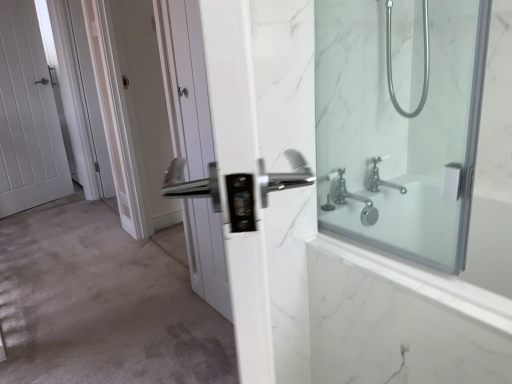
Identify the location of white wooden door at left, the first door viewed from the left. (28, 116).

This screenshot has width=512, height=384. What do you see at coordinates (140, 101) in the screenshot? I see `satin nickel handle at center, the first screen door when ordered from front to back` at bounding box center [140, 101].

I want to click on silver metallic shower arm at upper right, so click(x=391, y=61).

This screenshot has width=512, height=384. What do you see at coordinates (380, 179) in the screenshot?
I see `chrome metallic faucet at upper right` at bounding box center [380, 179].

What do you see at coordinates (187, 85) in the screenshot?
I see `white glossy door handle at center, arranged as the second door when viewed from the left` at bounding box center [187, 85].

You are a GUI agent. You are given a task and a screenshot of the screen. Output one action in this format:
    pyautogui.click(x=<x>, y=<y>)
    Task: Click on the white glossy door at upper left, the 1th screen door positioned from the back
    The image size is (512, 384).
    Given the screenshot: What is the action you would take?
    pyautogui.click(x=91, y=98)

Which object is positioned more to the left, white glossy door handle at center, the second door when ordered from back to front, or white glossy door at upper left, the first screen door when ordered from left to right?

white glossy door at upper left, the first screen door when ordered from left to right, is more to the left.

Would you say white glossy door handle at center, arranged as the second door when viewed from the left, contains white glossy door at upper left, which is the second screen door from front to back?

Definitely not — white glossy door at upper left, which is the second screen door from front to back, is not inside white glossy door handle at center, arranged as the second door when viewed from the left.

In the scene shown: From the image's perspective, who appears lower, white glossy door handle at center, the second door when ordered from back to front, or white glossy door at upper left, the first screen door when ordered from left to right?

white glossy door handle at center, the second door when ordered from back to front, from the image's perspective.

Is white glossy door handle at center, the 1th door when ordered from front to back, facing towards white glossy door at upper left, which is the second screen door from front to back?

No, white glossy door handle at center, the 1th door when ordered from front to back, is not aimed at white glossy door at upper left, which is the second screen door from front to back.

In the scene shown: Is satin nickel handle at center, acting as the 1th screen door starting from the right, at the left side of white wooden door at left, placed as the first door when sorted from back to front?

No.

Considering the sizes of satin nickel handle at center, acting as the 1th screen door starting from the right, and white wooden door at left, which appears as the second door when viewed from the front, in the image, is satin nickel handle at center, acting as the 1th screen door starting from the right, taller or shorter than white wooden door at left, which appears as the second door when viewed from the front,?

Clearly, satin nickel handle at center, acting as the 1th screen door starting from the right, is shorter compared to white wooden door at left, which appears as the second door when viewed from the front.

From the image's perspective, is satin nickel handle at center, acting as the 1th screen door starting from the right, below white wooden door at left, the 2th door in the right-to-left sequence?

Correct, satin nickel handle at center, acting as the 1th screen door starting from the right, appears lower than white wooden door at left, the 2th door in the right-to-left sequence, in the image.

Where is `door above the white glossy door handle at center, the 1th door from the right (from the image's perspective)`? Image resolution: width=512 pixels, height=384 pixels. door above the white glossy door handle at center, the 1th door from the right (from the image's perspective) is located at coordinates (28, 116).

Is white wooden door at left, placed as the first door when sorted from back to front, oriented away from white glossy door handle at center, the 1th door from the right?

white wooden door at left, placed as the first door when sorted from back to front, does not have its back to white glossy door handle at center, the 1th door from the right.

Consider the image. Who is smaller, white wooden door at left, the 2th door in the right-to-left sequence, or white glossy door handle at center, arranged as the second door when viewed from the left?

white glossy door handle at center, arranged as the second door when viewed from the left, is smaller.

Is white wooden door at left, the first door viewed from the left, completely or partially outside of white glossy door handle at center, the 1th door from the right?

Yes.

From the image's perspective, is white glossy door at upper left, which is the 2th screen door in right-to-left order, over chrome metallic faucet at upper right?

Yes, from the image's perspective, white glossy door at upper left, which is the 2th screen door in right-to-left order, is on top of chrome metallic faucet at upper right.

Is white glossy door at upper left, the 1th screen door positioned from the back, aimed at chrome metallic faucet at upper right?

No, white glossy door at upper left, the 1th screen door positioned from the back, is not aimed at chrome metallic faucet at upper right.

Is white glossy door at upper left, the first screen door when ordered from left to right, not near chrome metallic faucet at upper right?

Absolutely, white glossy door at upper left, the first screen door when ordered from left to right, is distant from chrome metallic faucet at upper right.

Which object is wider, white glossy door at upper left, the first screen door when ordered from left to right, or chrome metallic faucet at upper right?

chrome metallic faucet at upper right is wider.

How much distance is there between silver metallic shower arm at upper right and white glossy door at upper left, the first screen door when ordered from left to right?

silver metallic shower arm at upper right is 6.81 feet away from white glossy door at upper left, the first screen door when ordered from left to right.

The width and height of the screenshot is (512, 384). Identify the location of shower in front of the white glossy door at upper left, the first screen door when ordered from left to right. (391, 61).

In the scene shown: Which object is wider, silver metallic shower arm at upper right or white glossy door at upper left, the 1th screen door positioned from the back?

Wider between the two is silver metallic shower arm at upper right.

Choose the correct answer: Is silver metallic shower arm at upper right inside white glossy door at upper left, which is the second screen door from front to back, or outside it?

silver metallic shower arm at upper right is located beyond the bounds of white glossy door at upper left, which is the second screen door from front to back.

Relative to white glossy door handle at center, the 1th door from the right, is chrome metallic faucet at upper right in front or behind?

Clearly, chrome metallic faucet at upper right is behind white glossy door handle at center, the 1th door from the right.

Is chrome metallic faucet at upper right positioned with its back to white glossy door handle at center, the second door when ordered from back to front?

chrome metallic faucet at upper right does not have its back to white glossy door handle at center, the second door when ordered from back to front.

How much distance is there between chrome metallic faucet at upper right and white glossy door handle at center, the 1th door when ordered from front to back?

A distance of 30.35 inches exists between chrome metallic faucet at upper right and white glossy door handle at center, the 1th door when ordered from front to back.

Looking at this image, considering the sizes of objects chrome metallic faucet at upper right and white glossy door handle at center, arranged as the second door when viewed from the left, in the image provided, who is taller, chrome metallic faucet at upper right or white glossy door handle at center, arranged as the second door when viewed from the left,?

white glossy door handle at center, arranged as the second door when viewed from the left.

How much distance is there between clear glass shower at right and white glossy door at upper left, the first screen door when ordered from left to right?

A distance of 6.35 feet exists between clear glass shower at right and white glossy door at upper left, the first screen door when ordered from left to right.

From a real-world perspective, is clear glass shower at right positioned above or below white glossy door at upper left, the 1th screen door positioned from the back?

From a real-world perspective, clear glass shower at right is physically above white glossy door at upper left, the 1th screen door positioned from the back.

Which object is closer to the camera taking this photo, clear glass shower at right or white glossy door at upper left, the first screen door when ordered from left to right?

clear glass shower at right is in front.

Is clear glass shower at right positioned beyond the bounds of white glossy door at upper left, the 1th screen door positioned from the back?

Yes, clear glass shower at right is not within white glossy door at upper left, the 1th screen door positioned from the back.

You are a GUI agent. You are given a task and a screenshot of the screen. Output one action in this format:
    pyautogui.click(x=<x>, y=<y>)
    Task: Click on the door directly beneath the white glossy door at upper left, which is the second screen door from front to back (from a real-world perspective)
    This screenshot has width=512, height=384.
    Given the screenshot: What is the action you would take?
    pyautogui.click(x=187, y=85)

The height and width of the screenshot is (384, 512). Find the location of `door above the satin nickel handle at center, acting as the 2th screen door starting from the back (from a real-world perspective)`. door above the satin nickel handle at center, acting as the 2th screen door starting from the back (from a real-world perspective) is located at coordinates (28, 116).

From the image, which object appears to be farther from white glossy door at upper left, the 1th screen door positioned from the back, silver metallic shower arm at upper right or white matte door at center?

Among the two, silver metallic shower arm at upper right is located further to white glossy door at upper left, the 1th screen door positioned from the back.

From the image, which object appears to be farther from white glossy door at upper left, the first screen door when ordered from left to right, white glossy door handle at center, arranged as the second door when viewed from the left, or satin nickel handle at center, acting as the 1th screen door starting from the right?

The object further to white glossy door at upper left, the first screen door when ordered from left to right, is white glossy door handle at center, arranged as the second door when viewed from the left.

Looking at the image, which one is located further to white glossy door handle at center, the 1th door when ordered from front to back, chrome metallic faucet at upper right or satin nickel handle at center, which appears as the 2th screen door when viewed from the left?

satin nickel handle at center, which appears as the 2th screen door when viewed from the left, is positioned further to the anchor white glossy door handle at center, the 1th door when ordered from front to back.

Based on their spatial positions, is satin nickel handle at center, acting as the 1th screen door starting from the right, or silver metallic shower arm at upper right closer to clear glass shower at right?

silver metallic shower arm at upper right lies closer to clear glass shower at right than the other object.

From the image, which object appears to be nearer to white glossy door at upper left, the first screen door when ordered from left to right, white matte door at center or white glossy door handle at center, the second door when ordered from back to front?

white matte door at center is closer to white glossy door at upper left, the first screen door when ordered from left to right.

Considering their positions, is chrome metallic faucet at upper right positioned further to silver metallic shower arm at upper right than white glossy door at upper left, which is the second screen door from front to back?

Among the two, white glossy door at upper left, which is the second screen door from front to back, is located further to silver metallic shower arm at upper right.

From the image, which object appears to be farther from white glossy door at upper left, which is the 2th screen door in right-to-left order, chrome metallic faucet at upper right or white wooden door at left, the first door viewed from the left?

chrome metallic faucet at upper right lies further to white glossy door at upper left, which is the 2th screen door in right-to-left order, than the other object.

Looking at the image, which one is located further to white matte door at center, white wooden door at left, placed as the first door when sorted from back to front, or chrome metallic faucet at upper right?

Among the two, chrome metallic faucet at upper right is located further to white matte door at center.

Identify the location of shower located between white glossy door handle at center, the second door when ordered from back to front, and white marble bathtub at right in the left-right direction. This screenshot has height=384, width=512. (391, 61).

Locate an element on the screen. mirror located between white wooden door at left, the 2th door in the right-to-left sequence, and white marble bathtub at right in the left-right direction is located at coordinates (401, 121).

This screenshot has width=512, height=384. I want to click on door situated between white matte door at center and clear glass shower at right from left to right, so click(x=187, y=85).

Identify the location of shower situated between satin nickel handle at center, acting as the 2th screen door starting from the back, and white marble bathtub at right from left to right. The image size is (512, 384). (391, 61).